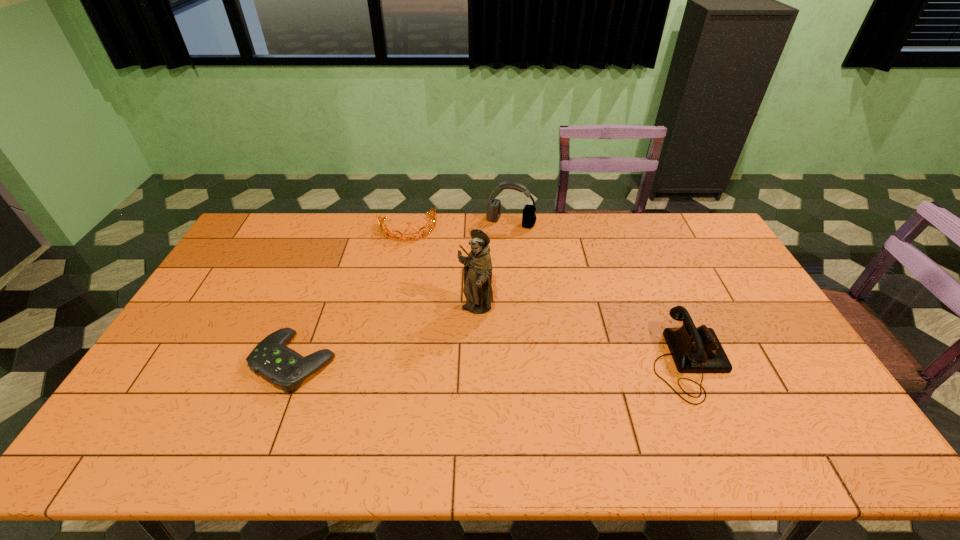
Identify the location of vacant region between the figurine and the second tallest object. (493, 266).

You are a GUI agent. You are given a task and a screenshot of the screen. Output one action in this format:
    pyautogui.click(x=<x>, y=<y>)
    Task: Click on the free spot between the tiara and the second tallest object
    Image resolution: width=960 pixels, height=540 pixels.
    Given the screenshot: What is the action you would take?
    pyautogui.click(x=459, y=225)

I want to click on vacant space in between the second shortest object and the telephone, so click(548, 295).

Locate an element on the screen. free point between the figurine and the fourth object from right to left is located at coordinates point(442,268).

At what (x,y) coordinates should I click in order to perform the action: click on free area in between the headset and the shortest object. Please return your answer as a coordinate pair (x, y). This screenshot has width=960, height=540. Looking at the image, I should click on (402, 292).

Identify the location of free spot between the tallest object and the headset. This screenshot has height=540, width=960. (493, 266).

The height and width of the screenshot is (540, 960). I want to click on vacant area between the second object from left to right and the shortest object, so click(351, 294).

At what (x,y) coordinates should I click in order to perform the action: click on free space between the second shortest object and the control. Please return your answer as a coordinate pair (x, y). Looking at the image, I should click on (351, 294).

Image resolution: width=960 pixels, height=540 pixels. Identify the location of vacant area that lies between the shortest object and the tiara. (351, 294).

Identify the location of object that is the second closest one to the headset. The height and width of the screenshot is (540, 960). (477, 289).